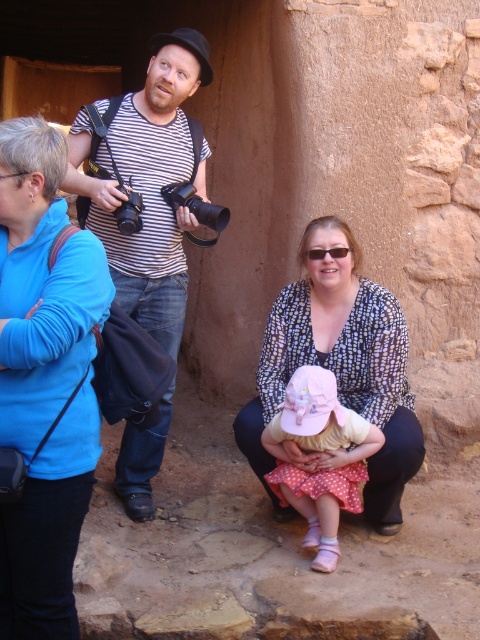
Question: Among these points, which one is nearest to the camera?

Choices:
 (A) (120, 208)
 (B) (170, 180)
 (C) (395, 412)
 (D) (212, 212)

Answer: (A)

Question: Can you confirm if striped cotton shirt at center is wider than black plastic camera at center?

Choices:
 (A) yes
 (B) no

Answer: (A)

Question: Can you confirm if polka dot blouse at center is bigger than black plastic camera at upper center?

Choices:
 (A) no
 (B) yes

Answer: (B)

Question: Which of the following is the farthest from the observer?

Choices:
 (A) coord(387,404)
 (B) coord(142,209)
 (C) coord(41,337)

Answer: (B)

Question: Does striped cotton shirt at center appear on the right side of black plastic camera at upper center?

Choices:
 (A) yes
 (B) no

Answer: (B)

Question: Which point is farther from the camera taking this photo?

Choices:
 (A) (216, 225)
 (B) (134, 195)
 (C) (24, 486)
 (D) (396, 454)

Answer: (A)